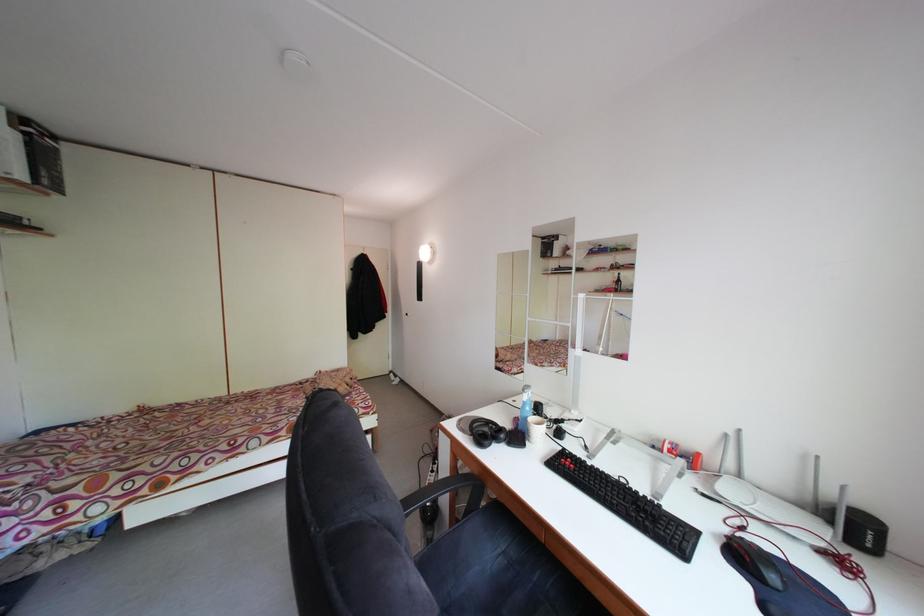
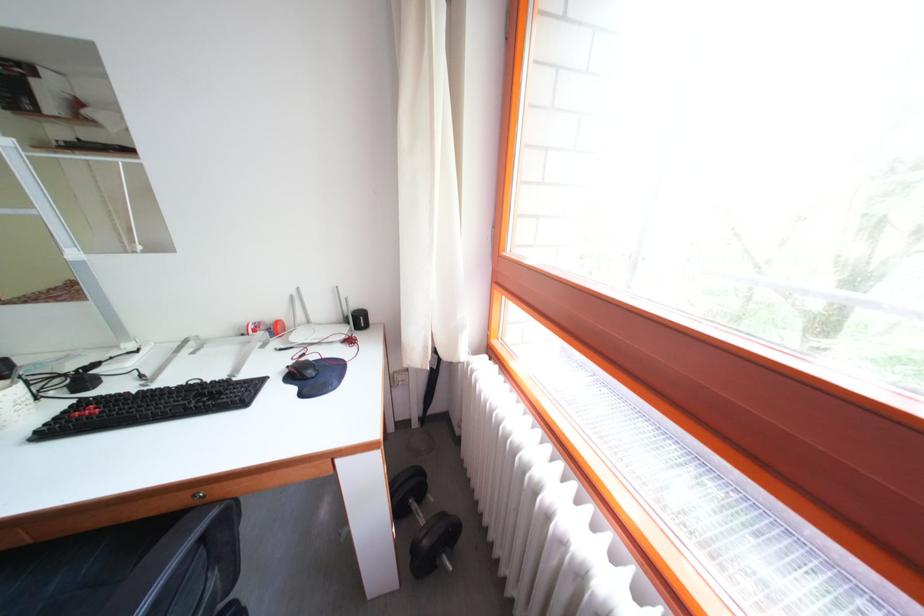
The images are taken continuously from a first-person perspective. In which direction is your viewpoint rotating?

The camera's rotation is toward right-down.